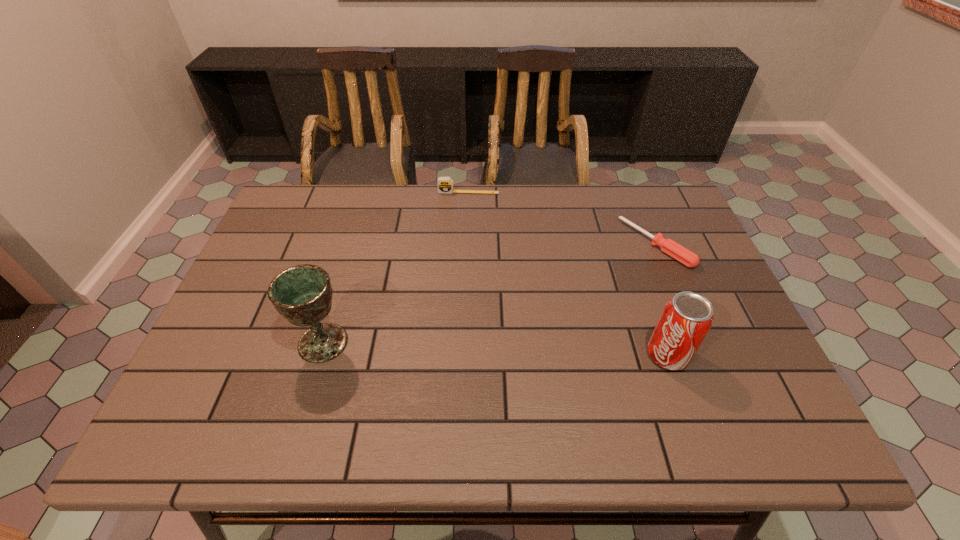
Find the location of `object that is the second closest to the third nearest object`. object that is the second closest to the third nearest object is located at coordinates (445, 184).

Locate an element on the screen. object that is the third closest to the chalice is located at coordinates (681, 254).

At what (x,y) coordinates should I click in order to perform the action: click on blank space that satisfies the following two spatial constraints: 1. on the back side of the leftmost object; 2. on the left side of the screwdriver. Please return your answer as a coordinate pair (x, y). Image resolution: width=960 pixels, height=540 pixels. Looking at the image, I should click on (352, 244).

The width and height of the screenshot is (960, 540). What are the coordinates of `blank space that satisfies the following two spatial constraints: 1. on the front side of the chalice; 2. on the right side of the third shortest object` in the screenshot? It's located at (320, 355).

Locate an element on the screen. The width and height of the screenshot is (960, 540). vacant area that satisfies the following two spatial constraints: 1. on the front side of the second tallest object; 2. on the left side of the tape measure is located at coordinates (464, 355).

This screenshot has width=960, height=540. I want to click on free space that satisfies the following two spatial constraints: 1. on the front side of the third shortest object; 2. on the left side of the chalice, so click(x=320, y=355).